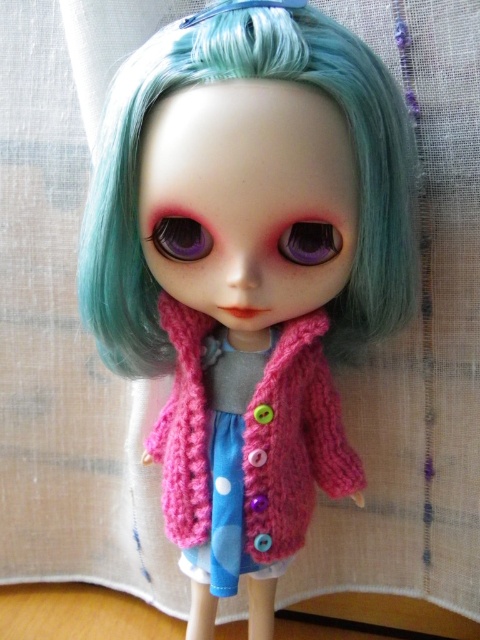
Which is behind, point (280, 323) or point (233, 376)?

Point (233, 376)

Can you confirm if pink knitted cardigan at center is positioned above pink knitted dress at center?

Indeed, pink knitted cardigan at center is positioned over pink knitted dress at center.

Who is more forward, (215, 221) or (214, 496)?

Point (215, 221) is more forward.

At what (x,y) coordinates should I click in order to perform the action: click on pink knitted cardigan at center. Please return your answer as a coordinate pair (x, y). This screenshot has height=640, width=480. Looking at the image, I should click on (248, 269).